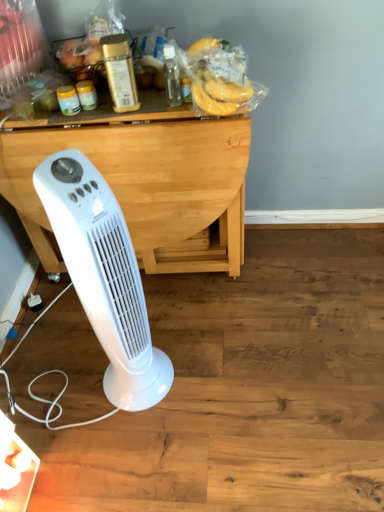
Identify the location of free space in front of white plastic tower fan at lower left. The width and height of the screenshot is (384, 512). (136, 440).